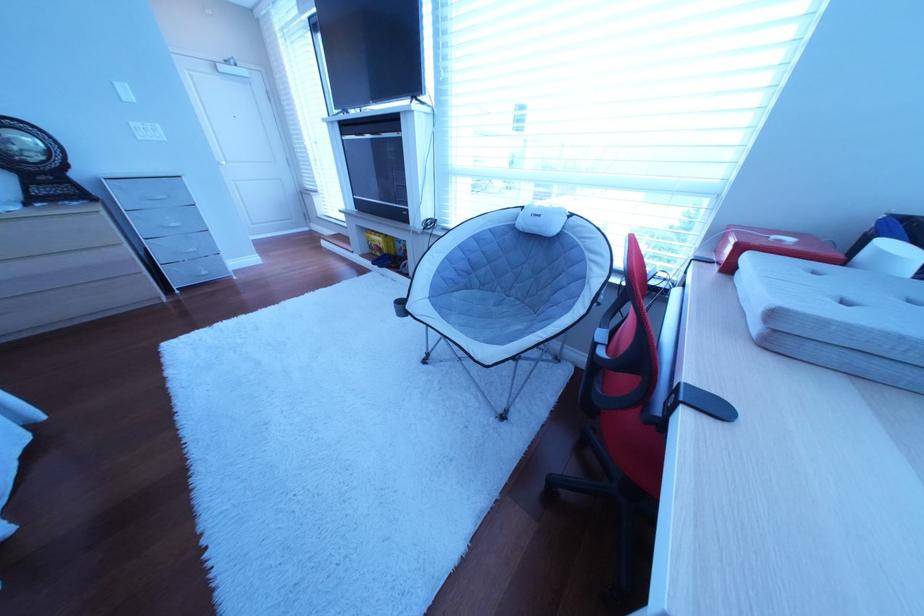
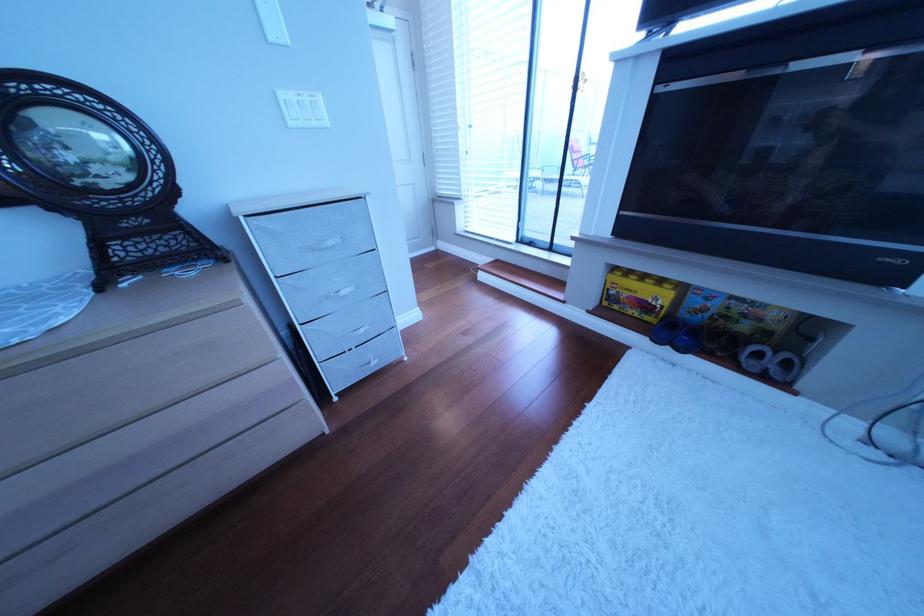
Locate, in the second image, the point that corresponds to (388,246) in the first image.

(640, 296)